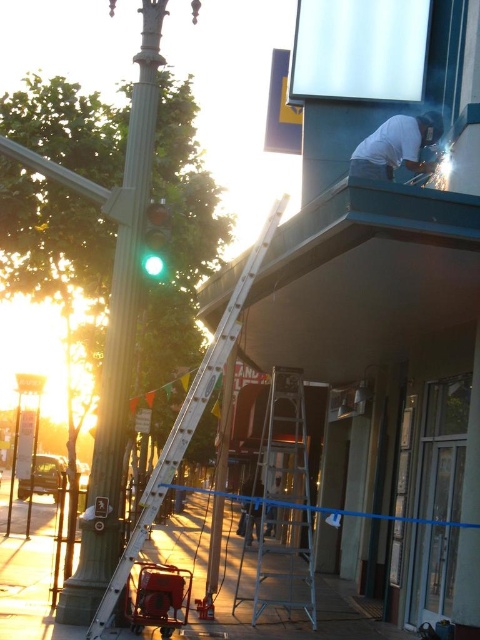
Question: Is silver metallic ladder at center wider than white matte shirt at upper center?

Choices:
 (A) no
 (B) yes

Answer: (B)

Question: Considering the real-world distances, which object is closest to the white matte shirt at upper center?

Choices:
 (A) green polished metal pole at left
 (B) green glass traffic light at center-left
 (C) white aluminum ladder at center
 (D) silver metallic ladder at center

Answer: (B)

Question: Which of these objects is positioned closest to the green polished metal pole at left?

Choices:
 (A) green glass traffic light at center-left
 (B) white aluminum ladder at center
 (C) white matte shirt at upper center
 (D) silver metallic ladder at center

Answer: (A)

Question: Can you confirm if green polished metal pole at left is thinner than white matte shirt at upper center?

Choices:
 (A) yes
 (B) no

Answer: (A)

Question: In this image, where is white aluminum ladder at center located relative to white matte shirt at upper center?

Choices:
 (A) right
 (B) left

Answer: (B)

Question: Which object appears closest to the camera in this image?

Choices:
 (A) green glass traffic light at center-left
 (B) white matte shirt at upper center
 (C) silver metallic ladder at center
 (D) white aluminum ladder at center

Answer: (C)